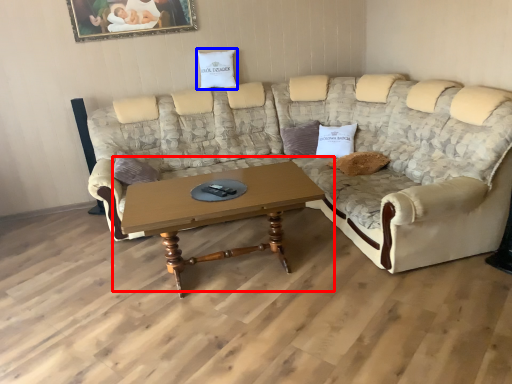
Question: Among these objects, which one is farthest to the camera, coffee table (highlighted by a red box) or pillow (highlighted by a blue box)?

Choices:
 (A) coffee table
 (B) pillow

Answer: (B)